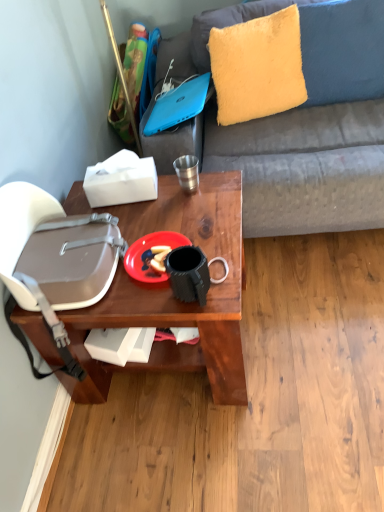
The height and width of the screenshot is (512, 384). In order to click on vacant space to the right of wooden table at center in this screenshot , I will do `click(308, 316)`.